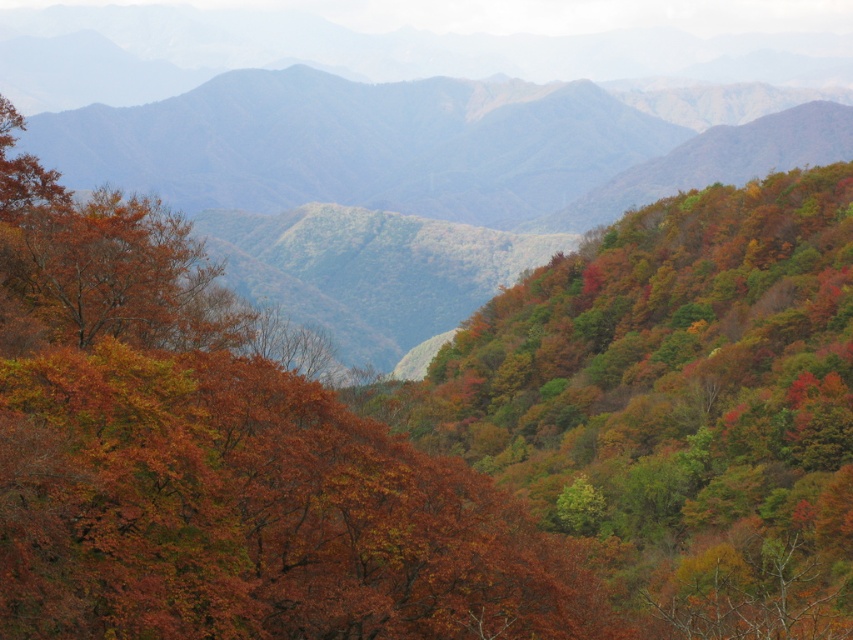
Consider the image. You are standing in the mountain landscape scene. There is a point marked at coordinates (x=221, y=460). What is located at that point?

The point at coordinates (x=221, y=460) indicates autumn leaves at center.

You are an artist planning to paint the autumn scene. You want to ensure the autumn leaves at center and multicolored foliage at center are proportionally accurate. Which object should you paint smaller to maintain the scene perspective?

The autumn leaves at center should be painted smaller than the multicolored foliage at center to maintain the scene perspective since the autumn leaves at center has a smaller size compared to multicolored foliage at center.